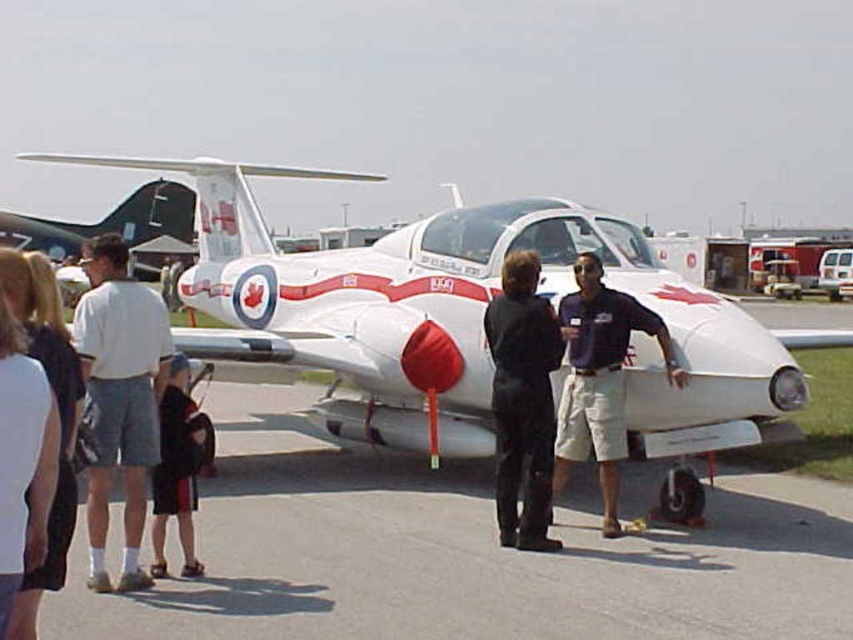
Who is lower down, black leather pants at center or white cotton shirt at left?

A: black leather pants at center

What are the coordinates of `black leather pants at center` in the screenshot? It's located at (521, 401).

Is dark blue shirt at center wider than white cotton shirt at left?

Yes.

Can you confirm if dark blue shirt at center is taller than white cotton shirt at left?

Correct, dark blue shirt at center is much taller as white cotton shirt at left.

The height and width of the screenshot is (640, 853). I want to click on dark blue shirt at center, so [601, 378].

This screenshot has width=853, height=640. Describe the element at coordinates (460, 317) in the screenshot. I see `white matte airplane at center` at that location.

Looking at this image, does white matte airplane at center come in front of white cotton shirt at left?

No.

Locate an element on the screen. The image size is (853, 640). white matte airplane at center is located at coordinates (460, 317).